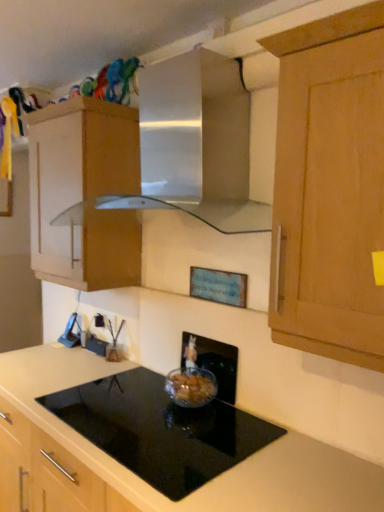
Question: Considering the positions of satin silver vent at upper center and black plastic electric outlet at lower left in the image, is satin silver vent at upper center taller or shorter than black plastic electric outlet at lower left?

Choices:
 (A) tall
 (B) short

Answer: (A)

Question: Considering the positions of satin silver vent at upper center and black plastic electric outlet at lower left in the image, is satin silver vent at upper center wider or thinner than black plastic electric outlet at lower left?

Choices:
 (A) wide
 (B) thin

Answer: (A)

Question: Estimate the real-world distances between objects in this image. Which object is closer to the black glass cooktop at center?

Choices:
 (A) black plastic electric outlet at lower left
 (B) wooden cabinet at upper left
 (C) satin silver vent at upper center
 (D) clear glass bowl at center

Answer: (D)

Question: Based on their relative distances, which object is farther from the black plastic electric outlet at lower left?

Choices:
 (A) wooden cabinet at upper left
 (B) satin silver vent at upper center
 (C) black glass cooktop at center
 (D) clear glass bowl at center

Answer: (B)